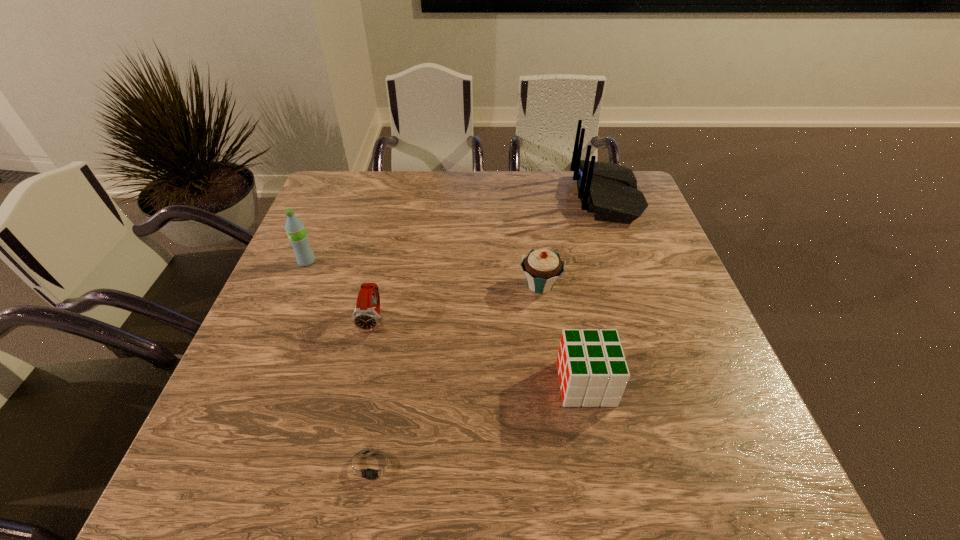
Identify the location of vacant space that satisfies the following two spatial constraints: 1. on the front side of the water bottle; 2. on the left side of the cupcake. This screenshot has height=540, width=960. click(x=297, y=285).